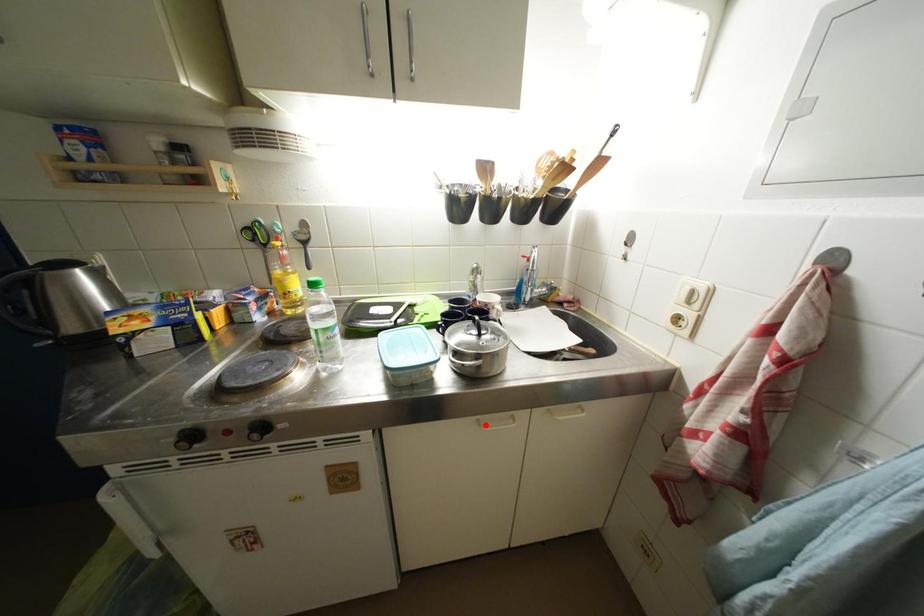
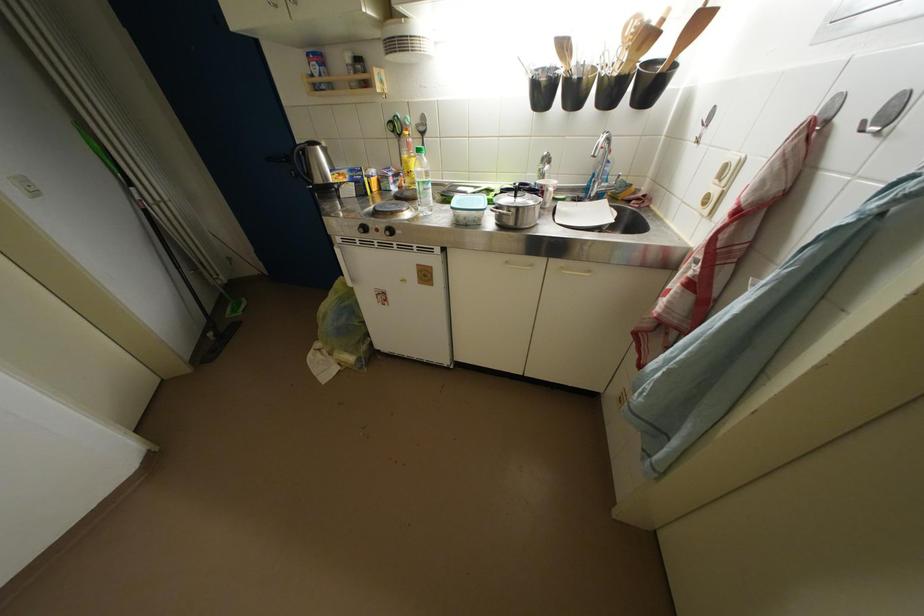
Locate, in the second image, the point that corresponds to the highlighted location in the first image.

(514, 265)